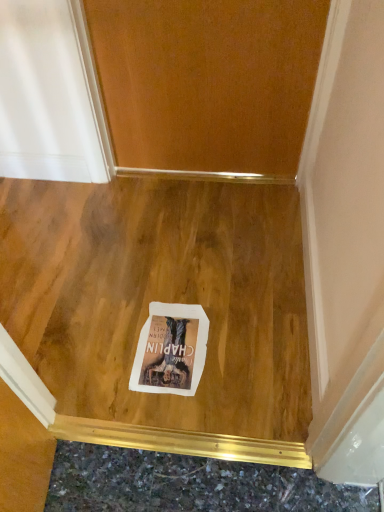
The image size is (384, 512). In order to click on free location to the right of white paper postcard at center in this screenshot , I will do `click(237, 354)`.